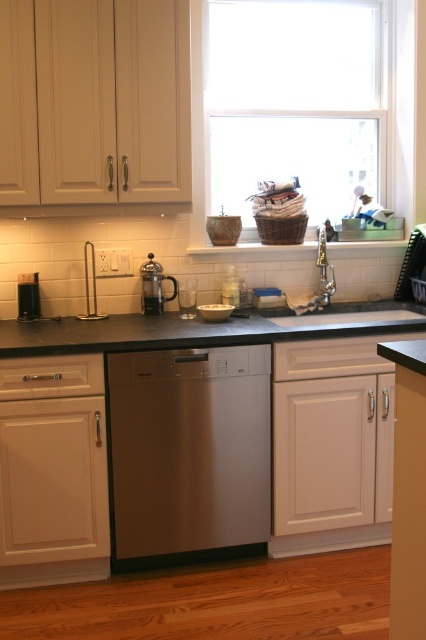
You are a kitchen designer planning to install a new faucet. The white porcelain sink at center and the satin silver french press at center are both in the way. Which one is shorter so you can adjust the faucet placement accordingly?

The white porcelain sink at center is shorter than the satin silver french press at center, so you should adjust the faucet placement around the white porcelain sink at center.